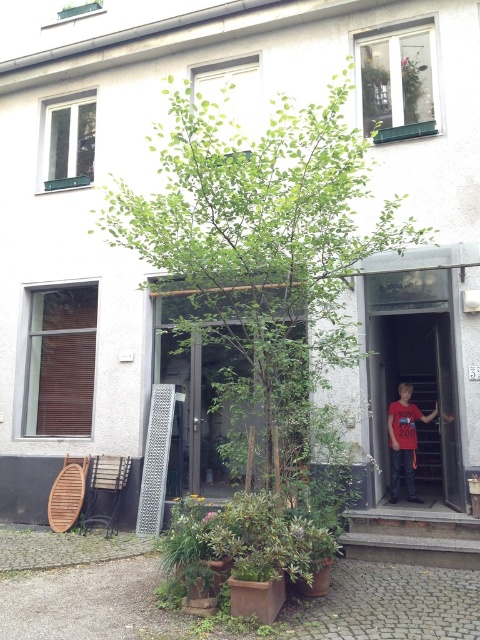
Question: Does green leafy tree at center have a smaller size compared to red fabric door at center?

Choices:
 (A) yes
 (B) no

Answer: (B)

Question: Which point is farther from the camera taking this photo?

Choices:
 (A) (395, 442)
 (B) (432, 381)

Answer: (B)

Question: Which of the following is the closest to the observer?

Choices:
 (A) (283, 387)
 (B) (450, 388)
 (C) (394, 472)

Answer: (A)

Question: Can you confirm if green leafy tree at center is smaller than red fabric door at center?

Choices:
 (A) no
 (B) yes

Answer: (A)

Question: Is red fabric door at center closer to camera compared to red cotton t-shirt at center?

Choices:
 (A) no
 (B) yes

Answer: (B)

Question: Considering the real-world distances, which object is farthest from the red fabric door at center?

Choices:
 (A) red cotton t-shirt at center
 (B) green leafy tree at center

Answer: (B)